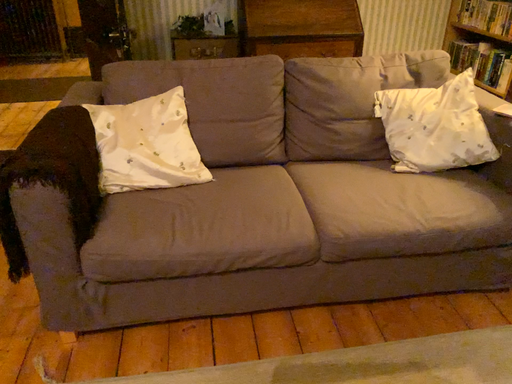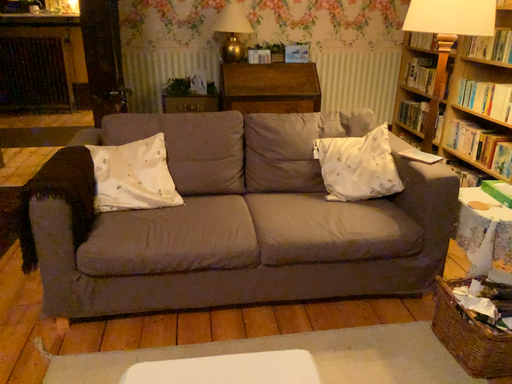
Question: Which way did the camera rotate in the video?

Choices:
 (A) rotated downward
 (B) rotated upward

Answer: (B)